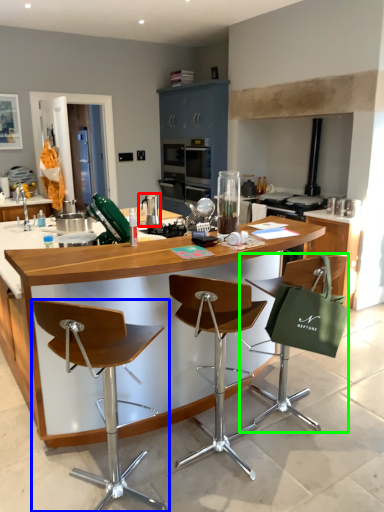
Question: Which is farther away from appliance (highlighted by a red box)? chair (highlighted by a blue box) or chair (highlighted by a green box)?

Choices:
 (A) chair
 (B) chair

Answer: (A)